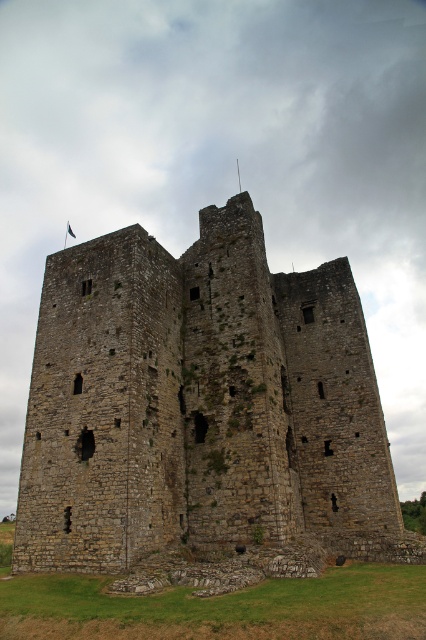
Between brown stone castle at center and black fabric flag at upper center, which one has more height?

brown stone castle at center is taller.

Can you confirm if brown stone castle at center is positioned below black fabric flag at upper center?

Correct, brown stone castle at center is located below black fabric flag at upper center.

What do you see at coordinates (201, 404) in the screenshot? The image size is (426, 640). I see `brown stone castle at center` at bounding box center [201, 404].

Locate an element on the screen. brown stone castle at center is located at coordinates point(201,404).